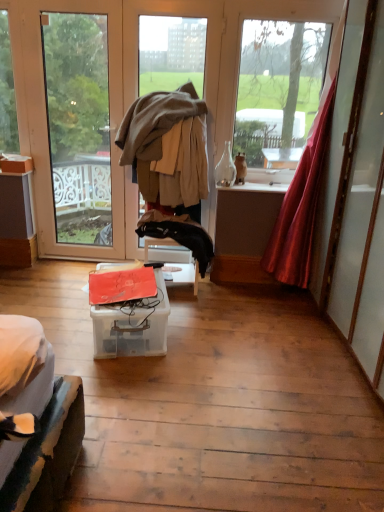
Question: Is black fabric jacket at center positioned before beige woolen jacket at center?

Choices:
 (A) no
 (B) yes

Answer: (A)

Question: From a real-world perspective, is black fabric jacket at center located higher than beige woolen jacket at center?

Choices:
 (A) no
 (B) yes

Answer: (A)

Question: Does black fabric jacket at center turn towards beige woolen jacket at center?

Choices:
 (A) no
 (B) yes

Answer: (A)

Question: From the image's perspective, would you say black fabric jacket at center is positioned over beige woolen jacket at center?

Choices:
 (A) no
 (B) yes

Answer: (A)

Question: Is black fabric jacket at center wider than beige woolen jacket at center?

Choices:
 (A) no
 (B) yes

Answer: (A)

Question: Is black fabric jacket at center in front of or behind transparent glass door at left, which is counted as the first window, starting from the left, in the image?

Choices:
 (A) front
 (B) behind

Answer: (A)

Question: Looking at the image, does black fabric jacket at center seem bigger or smaller compared to transparent glass door at left, marked as the second window in a right-to-left arrangement?

Choices:
 (A) big
 (B) small

Answer: (B)

Question: Is black fabric jacket at center taller or shorter than transparent glass door at left, which is counted as the first window, starting from the left?

Choices:
 (A) short
 (B) tall

Answer: (A)

Question: From the image's perspective, relative to transparent glass door at left, marked as the second window in a right-to-left arrangement, is black fabric jacket at center above or below?

Choices:
 (A) above
 (B) below

Answer: (B)

Question: In the image, is transparent plastic box at center, the 1th box ordered from the bottom, on the left side or the right side of beige woolen jacket at center?

Choices:
 (A) right
 (B) left

Answer: (B)

Question: Does point pos(89,309) appear closer or farther from the camera than point pos(187,156)?

Choices:
 (A) closer
 (B) farther

Answer: (A)

Question: From the image's perspective, relative to beige woolen jacket at center, is transparent plastic box at center, the 2th box positioned from the back, above or below?

Choices:
 (A) below
 (B) above

Answer: (A)

Question: Considering the positions of transparent plastic box at center, positioned as the first box in front-to-back order, and beige woolen jacket at center in the image, is transparent plastic box at center, positioned as the first box in front-to-back order, wider or thinner than beige woolen jacket at center?

Choices:
 (A) thin
 (B) wide

Answer: (B)

Question: Would you say clear glass bottle at center is to the left or to the right of transparent glass door at left, marked as the second window in a right-to-left arrangement, in the picture?

Choices:
 (A) right
 (B) left

Answer: (A)

Question: Is clear glass bottle at center in front of or behind transparent glass door at left, which is counted as the first window, starting from the left, in the image?

Choices:
 (A) front
 (B) behind

Answer: (B)